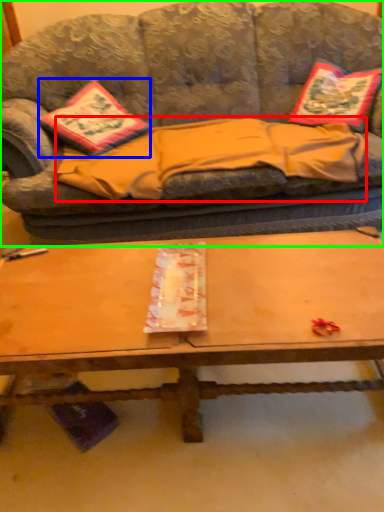
Question: Based on their relative distances, which object is nearer to blanket (highlighted by a red box)? Choose from throw pillow (highlighted by a blue box) and studio couch (highlighted by a green box).

Choices:
 (A) throw pillow
 (B) studio couch

Answer: (B)